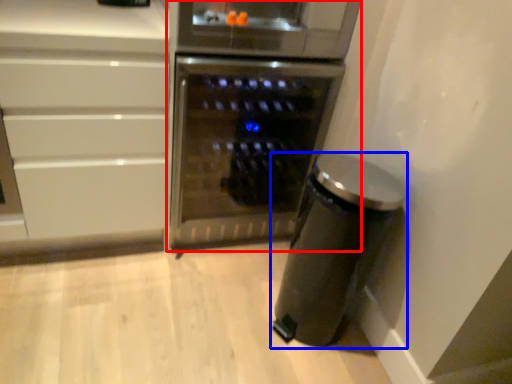
Question: Which object is closer to the camera taking this photo, home appliance (highlighted by a red box) or kitchen appliance (highlighted by a blue box)?

Choices:
 (A) home appliance
 (B) kitchen appliance

Answer: (B)